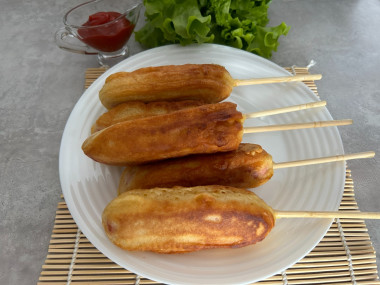
At what (x,y) coordinates should I click in order to perform the action: click on white plate. Please return your answer as a coordinate pair (x, y). Looking at the image, I should click on (78, 170).